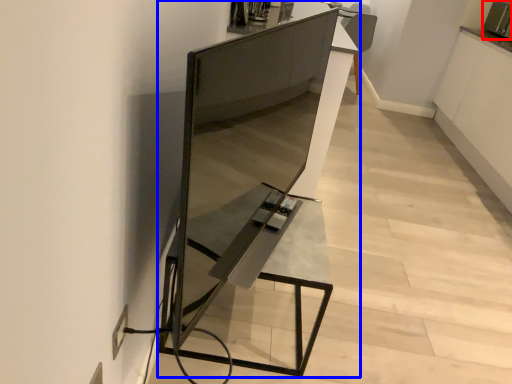
Question: Which object appears closest to the camera in this image, appliance (highlighted by a red box) or furniture (highlighted by a blue box)?

Choices:
 (A) appliance
 (B) furniture

Answer: (B)